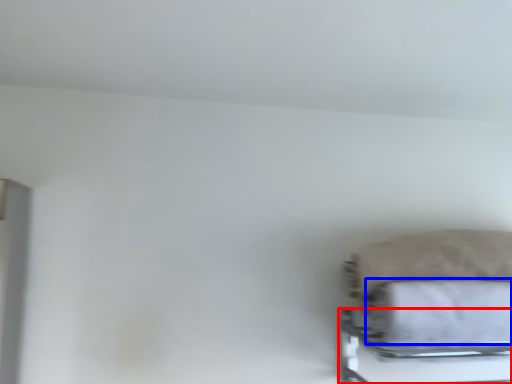
Question: Which point is further to the camera, bed frame (highlighted by a red box) or bath towel (highlighted by a blue box)?

Choices:
 (A) bed frame
 (B) bath towel

Answer: (B)